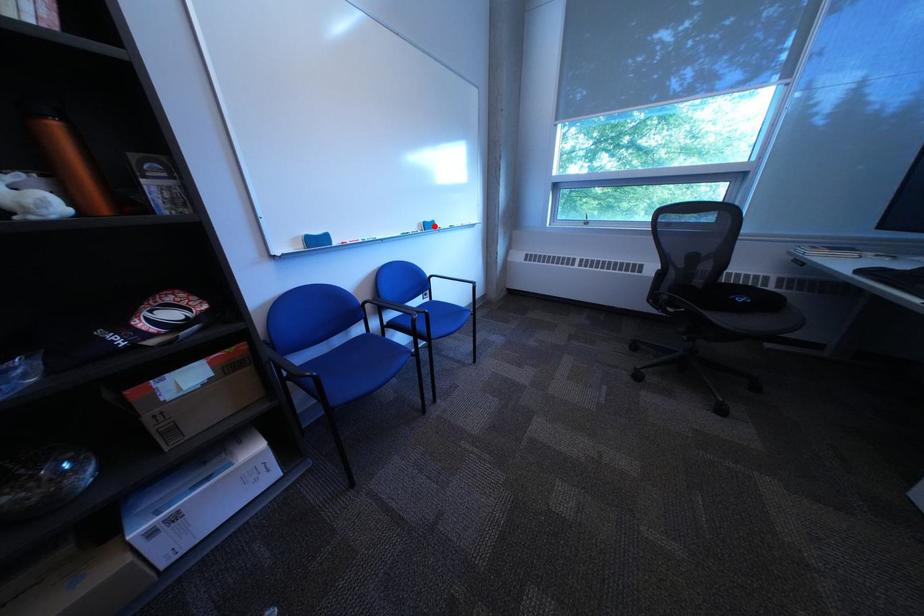
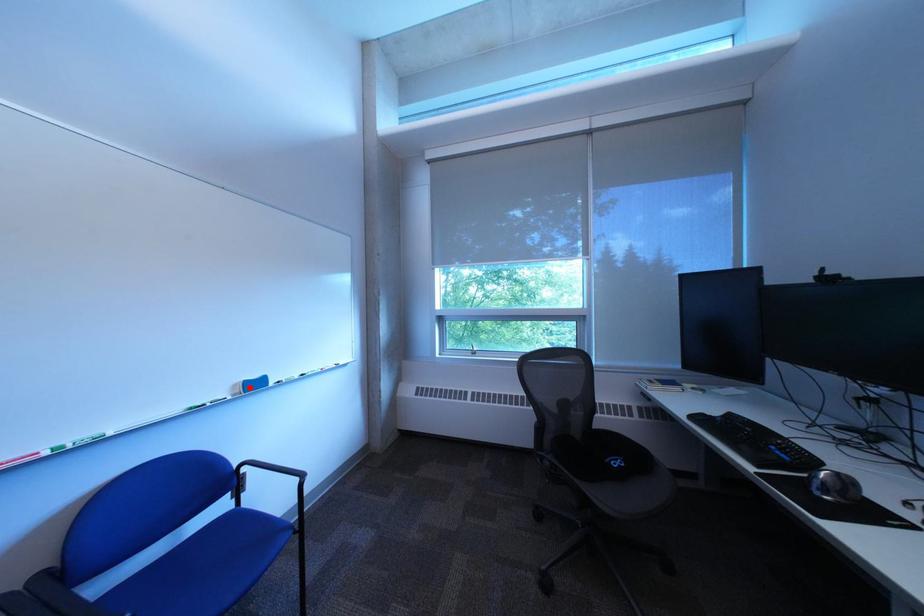
I am providing you with two images of the same scene from different viewpoints. A red point is marked on the first image and another point is marked on the second image. Do the highlighted points in image1 and image2 indicate the same real-world spot?

Yes